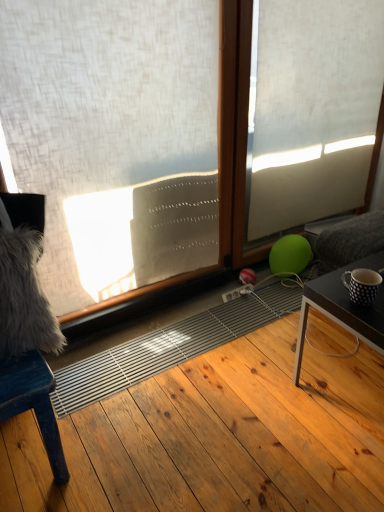
Question: Can you confirm if white textured curtain at upper left is wider than wooden chair at left?

Choices:
 (A) no
 (B) yes

Answer: (A)

Question: Would you consider white textured curtain at upper left to be distant from wooden chair at left?

Choices:
 (A) yes
 (B) no

Answer: (B)

Question: From the image's perspective, is white textured curtain at upper left located beneath wooden chair at left?

Choices:
 (A) yes
 (B) no

Answer: (B)

Question: Is white textured curtain at upper left thinner than wooden chair at left?

Choices:
 (A) yes
 (B) no

Answer: (A)

Question: Could you tell me if white textured curtain at upper left is turned towards wooden chair at left?

Choices:
 (A) yes
 (B) no

Answer: (B)

Question: Is white textured curtain at upper left positioned before wooden chair at left?

Choices:
 (A) no
 (B) yes

Answer: (A)

Question: Is natural wood floor at center not inside wooden chair at left?

Choices:
 (A) yes
 (B) no

Answer: (A)

Question: Is natural wood floor at center far away from wooden chair at left?

Choices:
 (A) no
 (B) yes

Answer: (A)

Question: Could wooden chair at left be considered to be inside natural wood floor at center?

Choices:
 (A) yes
 (B) no

Answer: (B)

Question: Is natural wood floor at center oriented towards wooden chair at left?

Choices:
 (A) yes
 (B) no

Answer: (A)

Question: Considering the relative sizes of natural wood floor at center and wooden chair at left in the image provided, is natural wood floor at center smaller than wooden chair at left?

Choices:
 (A) no
 (B) yes

Answer: (A)

Question: Considering the relative sizes of natural wood floor at center and wooden chair at left in the image provided, is natural wood floor at center shorter than wooden chair at left?

Choices:
 (A) yes
 (B) no

Answer: (A)

Question: Is dark brown wooden table at lower right outside wooden chair at left?

Choices:
 (A) yes
 (B) no

Answer: (A)